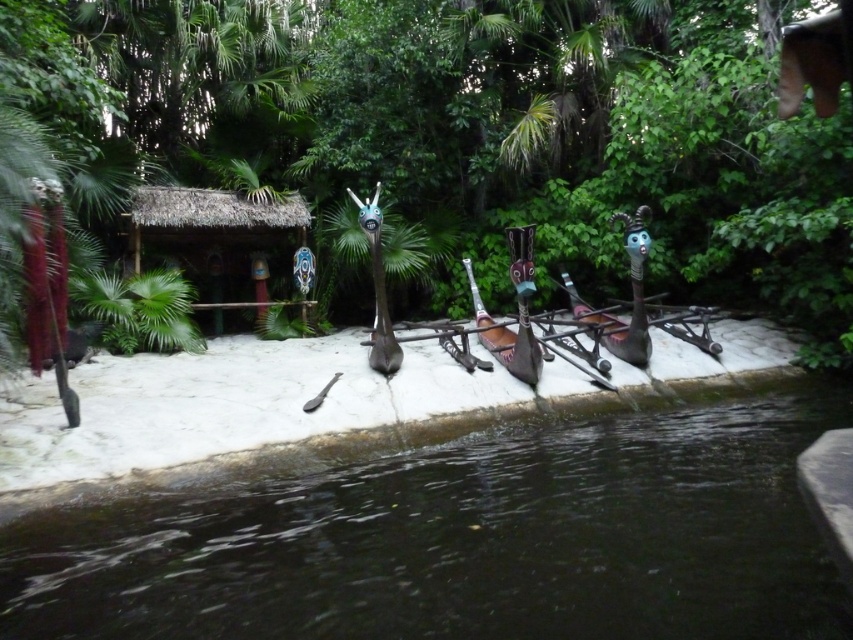
Question: Estimate the real-world distances between objects in this image. Which object is closer to the thatched straw hut at center?

Choices:
 (A) dark water at lower center
 (B) green leafy vegetation at center

Answer: (B)

Question: Is dark water at lower center wider than thatched straw hut at center?

Choices:
 (A) no
 (B) yes

Answer: (A)

Question: Which of the following is the closest to the observer?

Choices:
 (A) (198, 246)
 (B) (741, 429)

Answer: (B)

Question: Does green leafy vegetation at center appear on the left side of dark water at lower center?

Choices:
 (A) yes
 (B) no

Answer: (A)

Question: Is green leafy vegetation at center below thatched straw hut at center?

Choices:
 (A) no
 (B) yes

Answer: (A)

Question: Which is nearer to the green leafy vegetation at center?

Choices:
 (A) dark water at lower center
 (B) thatched straw hut at center

Answer: (B)